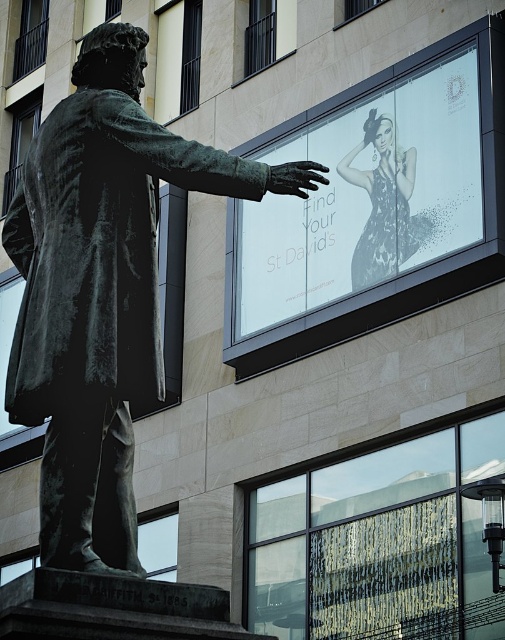
Can you confirm if bronze statue at center is wider than white glossy poster at upper center?

No, bronze statue at center is not wider than white glossy poster at upper center.

Which is more to the left, bronze statue at center or white glossy poster at upper center?

From the viewer's perspective, bronze statue at center appears more on the left side.

The image size is (505, 640). What do you see at coordinates (102, 289) in the screenshot? I see `bronze statue at center` at bounding box center [102, 289].

Identify the location of bronze statue at center. The width and height of the screenshot is (505, 640). 102,289.

Is bronze statue at center further to the viewer compared to shiny silver dress at upper center?

No, bronze statue at center is closer to the viewer.

Is bronze statue at center above shiny silver dress at upper center?

No.

Measure the distance between bronze statue at center and camera.

bronze statue at center is 19.15 meters from camera.

This screenshot has height=640, width=505. What are the coordinates of `bronze statue at center` in the screenshot? It's located at (102, 289).

Describe the element at coordinates (367, 195) in the screenshot. I see `white glossy poster at upper center` at that location.

What are the coordinates of `white glossy poster at upper center` in the screenshot? It's located at (367, 195).

Identify the location of white glossy poster at upper center. (367, 195).